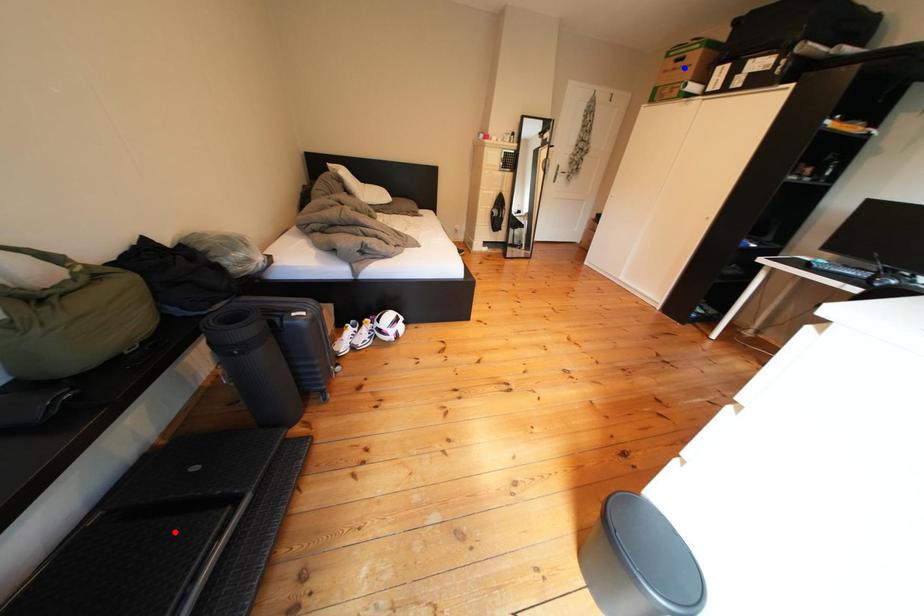
Question: In the image, two points are highlighted. Which point is nearer to the camera? Reply with the corresponding letter.

Choices:
 (A) blue point
 (B) red point

Answer: (B)